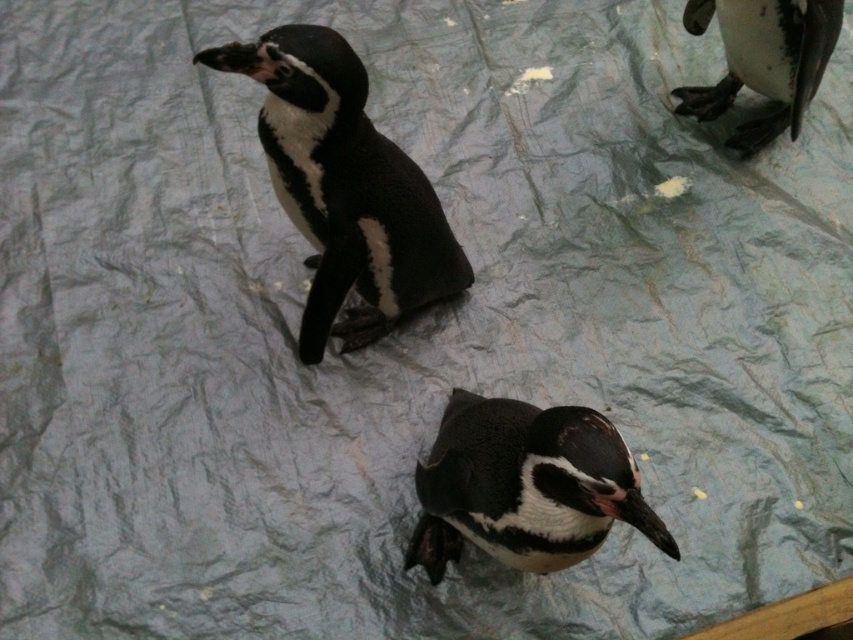
You are a photographer trying to capture both the black matte penguin at upper center and the black glossy penguin at upper right in a single shot. Which penguin should you focus on first to ensure both are in focus?

You should focus on the black matte penguin at upper center first because it is closer to the viewer than the black glossy penguin at upper right. By focusing on the closer penguin, the farther one will also be within the depth of field.

You are a zookeeper who needs to place a 10 inch wide feeding tray between the black matte penguin at upper center and the black matte penguin at center. Will the tray fit without overlapping either penguin?

The distance between the black matte penguin at upper center and the black matte penguin at center is 12.55 inches. Since the feeding tray is 10 inches wide, it will fit between them without overlapping either penguin as there is enough space.